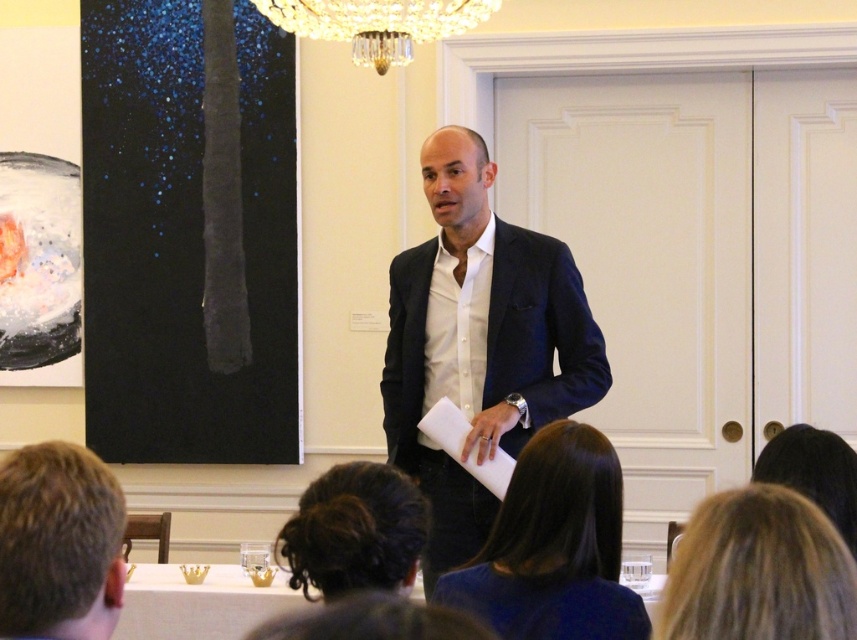
Question: Is the position of dark brown hair at lower center less distant than that of dark brown hair at upper center?

Choices:
 (A) no
 (B) yes

Answer: (B)

Question: Observing the image, what is the correct spatial positioning of matte black suit at center in reference to dark brown hair at lower center?

Choices:
 (A) right
 (B) left

Answer: (A)

Question: Which point is closer to the camera?

Choices:
 (A) 123,515
 (B) 306,19
 (C) 603,614

Answer: (A)

Question: Which object appears closest to the camera in this image?

Choices:
 (A) smooth dark blue hair at center
 (B) matte black suit at center

Answer: (A)

Question: Can you confirm if smooth dark blue hair at center is positioned to the left of blonde hair at lower right?

Choices:
 (A) yes
 (B) no

Answer: (A)

Question: Among these objects, which one is farthest from the camera?

Choices:
 (A) dark curly hair at lower center
 (B) dark brown hair at lower center
 (C) blonde hair at lower right
 (D) matte black suit at center

Answer: (D)